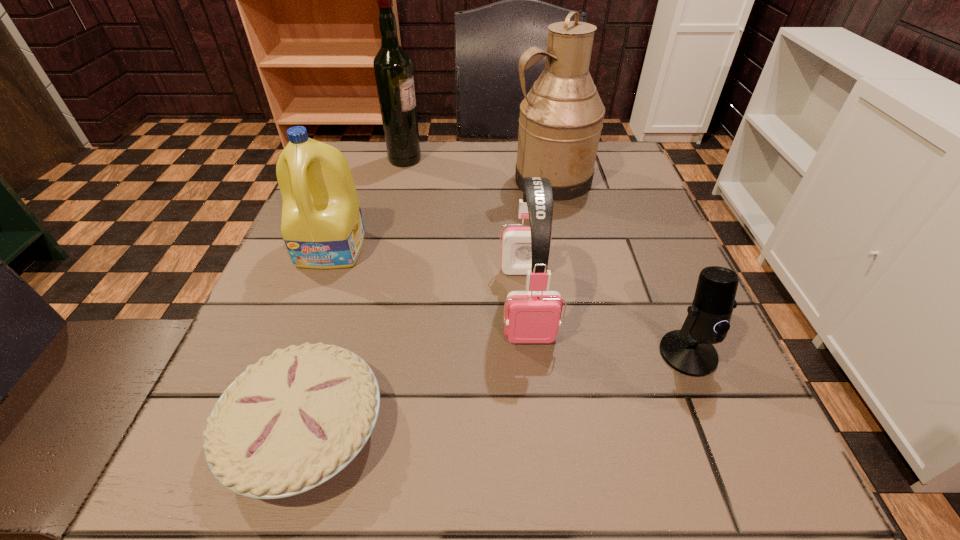
Where is `blank space located 0.050m on the outer surface of the earphone`? This screenshot has width=960, height=540. blank space located 0.050m on the outer surface of the earphone is located at coordinates (534, 374).

Locate an element on the screen. This screenshot has height=540, width=960. free space located 0.160m on the stand of the second shortest object is located at coordinates (745, 492).

Where is `free space located 0.390m on the right of the shortest object`? free space located 0.390m on the right of the shortest object is located at coordinates (680, 429).

In order to click on wine bottle that is positioned at the far edge in this screenshot , I will do `click(393, 68)`.

Where is `pitcher present at the far edge`? This screenshot has height=540, width=960. pitcher present at the far edge is located at coordinates (561, 118).

Identify the location of object situated at the near edge. (290, 422).

Find the location of a particular element. The width and height of the screenshot is (960, 540). wine bottle that is at the left edge is located at coordinates (393, 68).

The height and width of the screenshot is (540, 960). Find the location of `detergent that is positioned at the left edge`. detergent that is positioned at the left edge is located at coordinates (322, 226).

Identify the location of pie that is at the left edge. Image resolution: width=960 pixels, height=540 pixels. (x=290, y=422).

Locate an element on the screen. This screenshot has height=540, width=960. pitcher at the right edge is located at coordinates (561, 118).